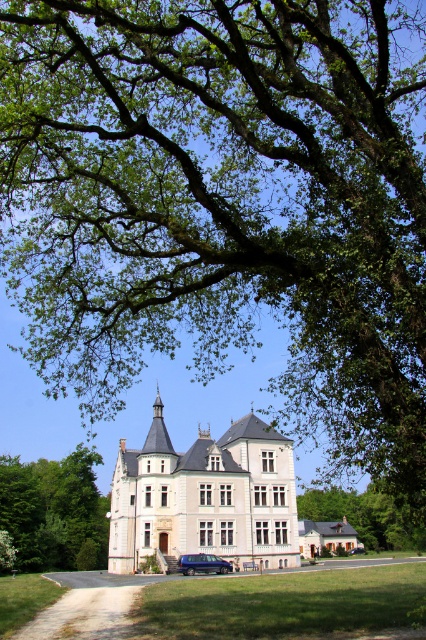
Does white stone castle at center appear on the right side of gray gravel driveway at center?

No, white stone castle at center is not to the right of gray gravel driveway at center.

Between point (147, 451) and point (310, 588), which one is positioned in front?

Positioned in front is point (310, 588).

Is point (170, 536) positioned before point (382, 572)?

That is True.

You are a GUI agent. You are given a task and a screenshot of the screen. Output one action in this format:
    pyautogui.click(x=<x>, y=<y>)
    Task: Click on the white stone castle at center
    This screenshot has height=640, width=426.
    Given the screenshot: What is the action you would take?
    pyautogui.click(x=204, y=497)

Can you confirm if white stone castle at center is smaller than green leafy tree at center?

Actually, white stone castle at center might be larger than green leafy tree at center.

Which is more to the left, white stone castle at center or green leafy tree at center?

green leafy tree at center

Locate an element on the screen. The width and height of the screenshot is (426, 640). white stone castle at center is located at coordinates (204, 497).

Is gray gravel driveway at center smaller than dark blue metallic van at lower center?

Actually, gray gravel driveway at center might be larger than dark blue metallic van at lower center.

Who is more distant from viewer, (62, 636) or (199, 566)?

Point (199, 566)

You are a GUI agent. You are given a task and a screenshot of the screen. Output one action in this format:
    pyautogui.click(x=<x>, y=<y>)
    Task: Click on the gray gravel driveway at center
    Image resolution: width=426 pixels, height=640 pixels.
    Given the screenshot: What is the action you would take?
    pyautogui.click(x=261, y=605)

Find the location of `gray gravel driveway at center`. gray gravel driveway at center is located at coordinates (261, 605).